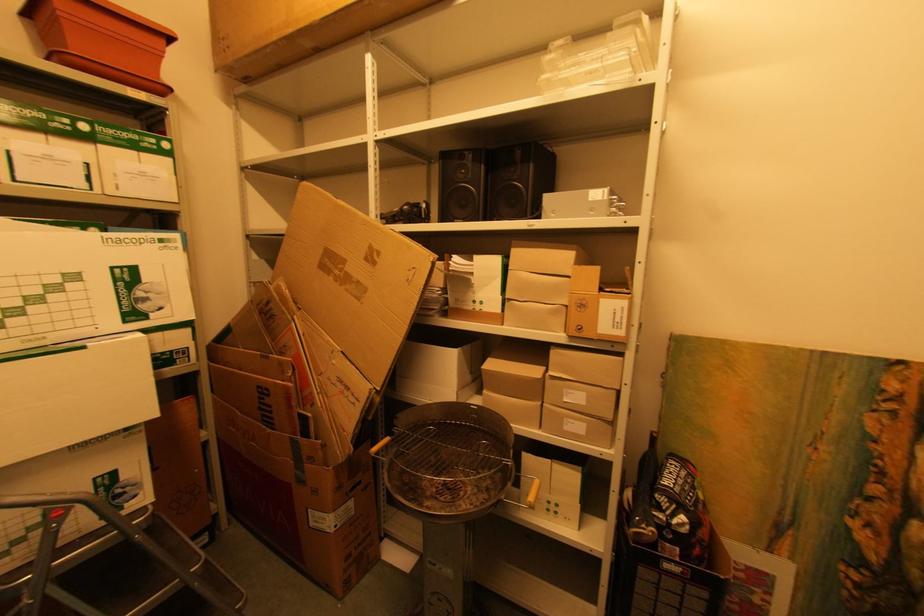
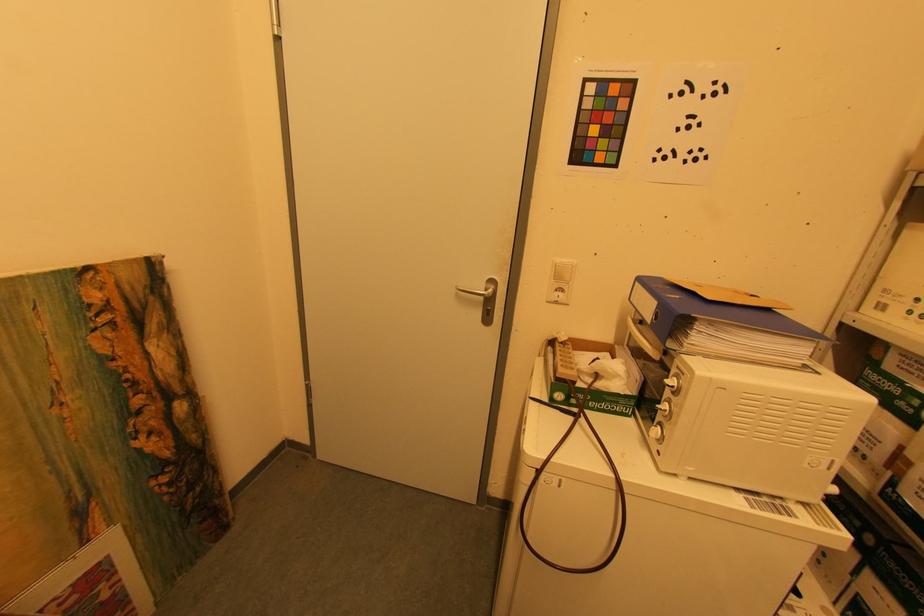
The first image is from the beginning of the video and the second image is from the end. How did the camera likely rotate when shooting the video?

The camera's rotation is toward right-down.